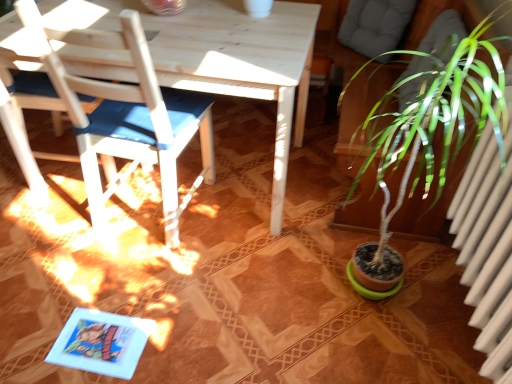
Question: From the image's perspective, is white wood chair at left, arranged as the first chair when viewed from the right, over white wood chair at left, the first chair viewed from the left?

Choices:
 (A) yes
 (B) no

Answer: (B)

Question: Is white wood chair at left, arranged as the first chair when viewed from the right, oriented away from white wood chair at left, the first chair viewed from the left?

Choices:
 (A) yes
 (B) no

Answer: (B)

Question: Is the depth of white wood chair at left, arranged as the first chair when viewed from the right, greater than that of white wood chair at left, arranged as the second chair when viewed from the right?

Choices:
 (A) yes
 (B) no

Answer: (B)

Question: Are white wood chair at left, arranged as the first chair when viewed from the right, and white wood chair at left, arranged as the second chair when viewed from the right, far apart?

Choices:
 (A) no
 (B) yes

Answer: (A)

Question: Is white wood chair at left, which is counted as the second chair, starting from the left, next to white wood chair at left, arranged as the second chair when viewed from the right?

Choices:
 (A) no
 (B) yes

Answer: (A)

Question: Can you confirm if white wood chair at left, arranged as the first chair when viewed from the right, is thinner than white wood chair at left, arranged as the second chair when viewed from the right?

Choices:
 (A) yes
 (B) no

Answer: (A)

Question: Does white wood chair at left, the first chair viewed from the left, turn towards white wood chair at left, which is counted as the second chair, starting from the left?

Choices:
 (A) no
 (B) yes

Answer: (A)

Question: Considering the relative sizes of white wood chair at left, arranged as the second chair when viewed from the right, and white wood chair at left, which is counted as the second chair, starting from the left, in the image provided, is white wood chair at left, arranged as the second chair when viewed from the right, bigger than white wood chair at left, which is counted as the second chair, starting from the left,?

Choices:
 (A) no
 (B) yes

Answer: (A)

Question: Is white wood chair at left, the first chair viewed from the left, further to the viewer compared to white wood chair at left, which is counted as the second chair, starting from the left?

Choices:
 (A) yes
 (B) no

Answer: (A)

Question: Is white wood chair at left, arranged as the second chair when viewed from the right, far from white wood chair at left, arranged as the first chair when viewed from the right?

Choices:
 (A) no
 (B) yes

Answer: (A)

Question: From a real-world perspective, is white wood chair at left, the first chair viewed from the left, physically above white wood chair at left, which is counted as the second chair, starting from the left?

Choices:
 (A) yes
 (B) no

Answer: (B)

Question: Does white wood chair at left, arranged as the second chair when viewed from the right, have a greater height compared to white wood chair at left, which is counted as the second chair, starting from the left?

Choices:
 (A) yes
 (B) no

Answer: (B)

Question: Considering the positions of white wood chair at left, arranged as the second chair when viewed from the right, and white wood chair at left, which is counted as the second chair, starting from the left, in the image, is white wood chair at left, arranged as the second chair when viewed from the right, taller or shorter than white wood chair at left, which is counted as the second chair, starting from the left,?

Choices:
 (A) tall
 (B) short

Answer: (B)